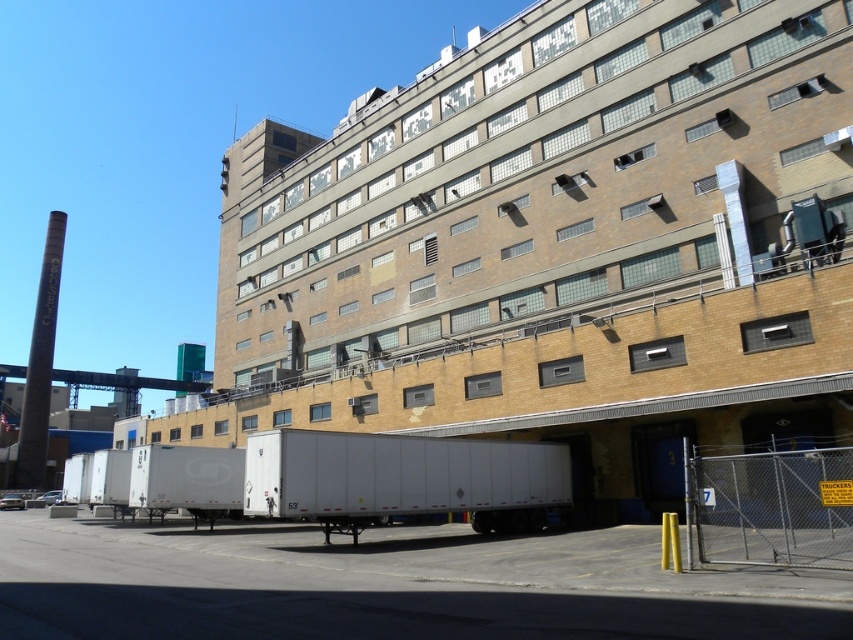
Between white matte trailer at lower center and white matte trailer truck at center, which one is positioned lower?

Positioned lower is white matte trailer truck at center.

The image size is (853, 640). Identify the location of white matte trailer at lower center. (550, 243).

The width and height of the screenshot is (853, 640). I want to click on white matte trailer at lower center, so click(x=550, y=243).